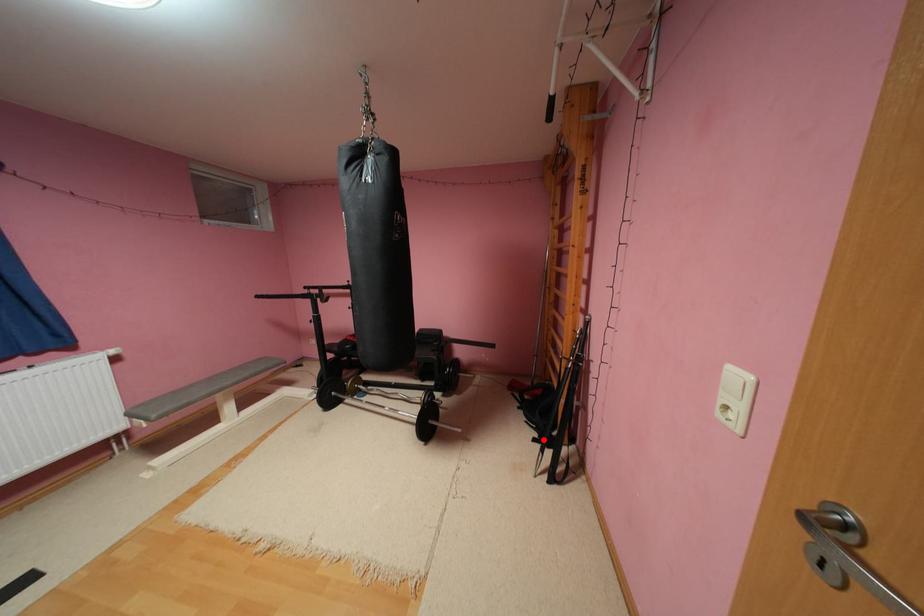
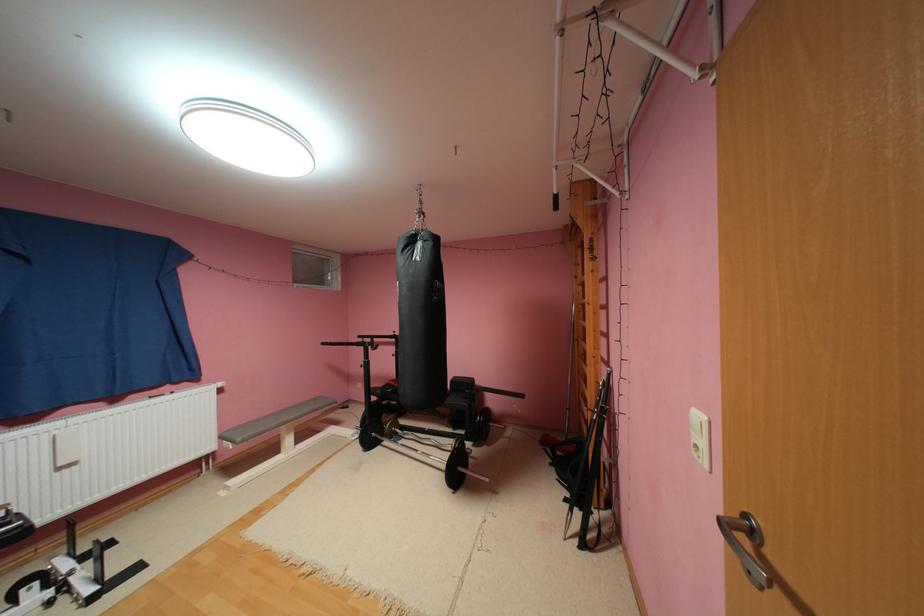
Question: A red point is marked in image1. In image2, is the corresponding 3D point closer to the camera or farther? Reply with the corresponding letter.

Choices:
 (A) The corresponding 3D point is closer.
 (B) The corresponding 3D point is farther.

Answer: (A)